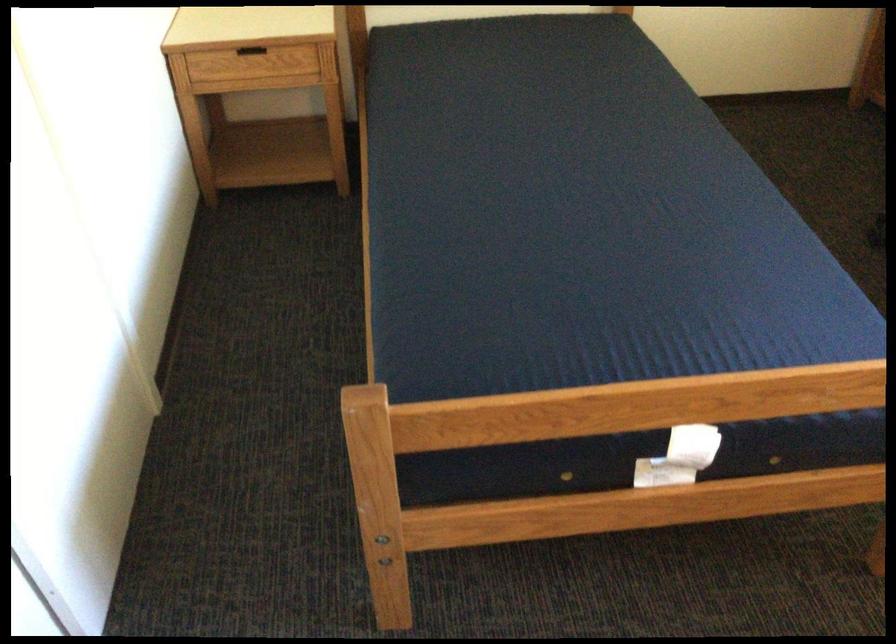
Locate an element on the screen. This screenshot has width=896, height=644. wooden drawer handle is located at coordinates click(x=250, y=49).